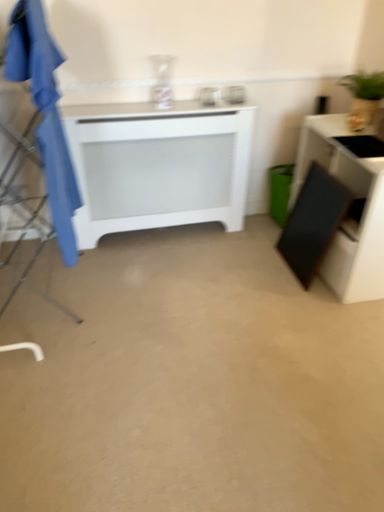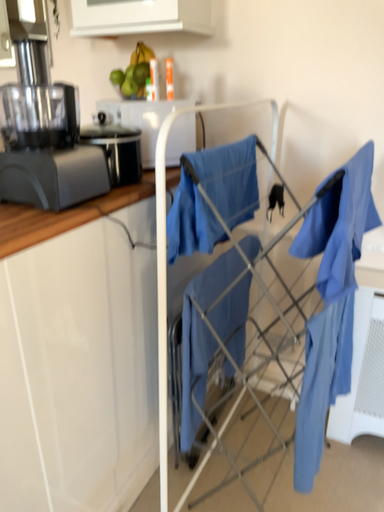
Question: How did the camera likely rotate when shooting the video?

Choices:
 (A) rotated upward
 (B) rotated downward

Answer: (A)